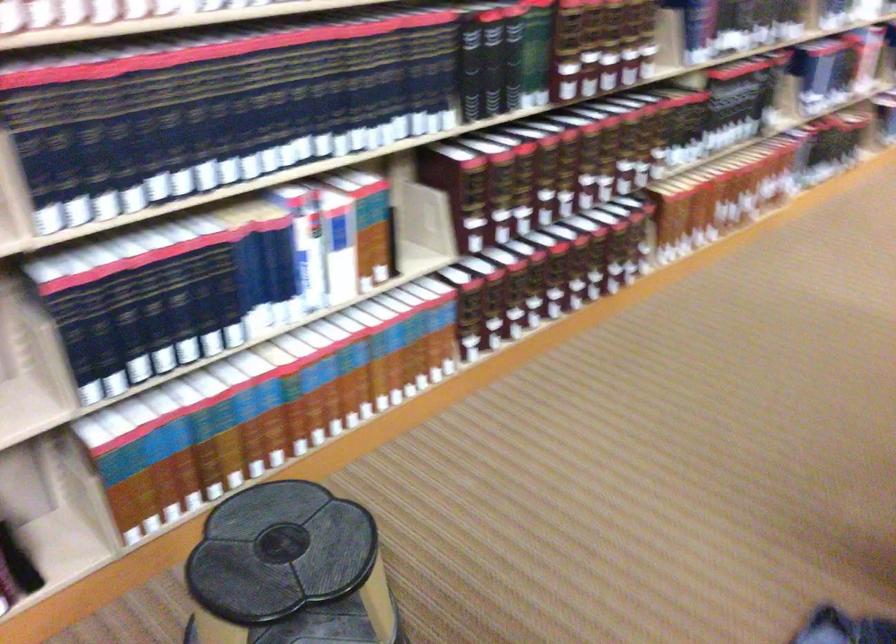
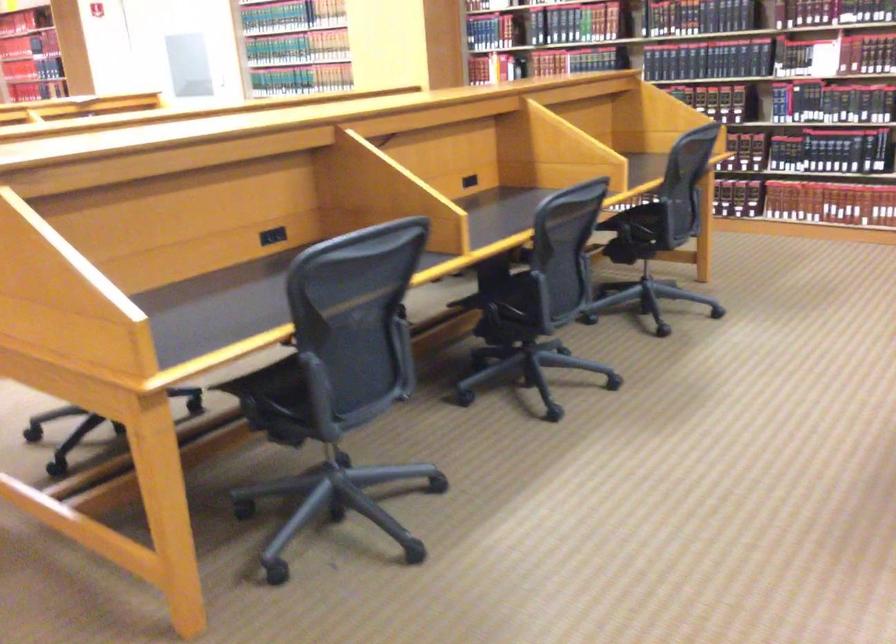
Question: I am providing you with two images of the same scene from different viewpoints. Please identify which objects are invisible in image2.

Choices:
 (A) hardcover book
 (B) chair armrest
 (C) beige book divider
 (D) pink plastic colander

Answer: (C)